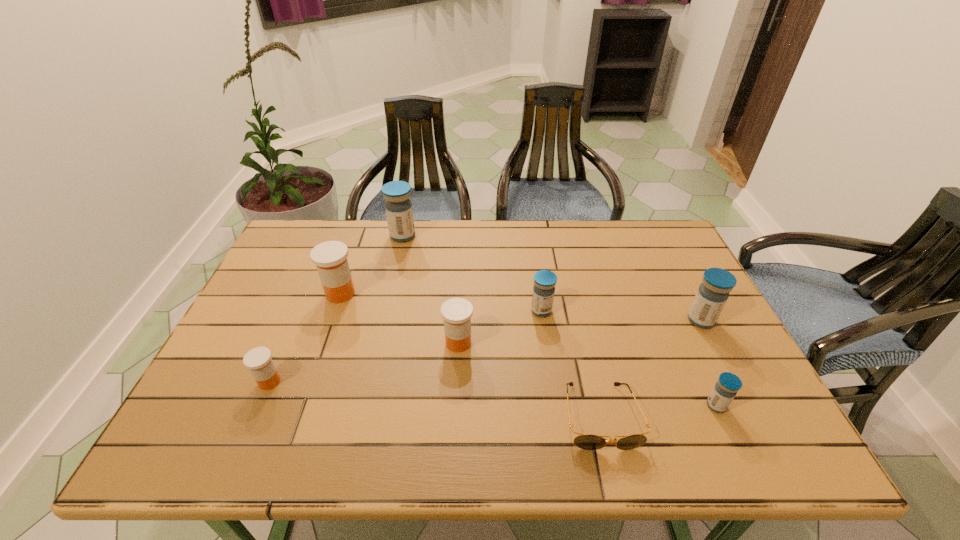
Identify the location of object that is the closest to the sunglasses. (x=728, y=384).

Identify which object is the sixth closest to the rightmost orange medicine. Please provide its 2D coordinates. Your answer should be formatted as a tuple, i.e. [(x, y)], where the tuple contains the x and y coordinates of a point satisfying the conditions above.

[(728, 384)]

Locate which medicine ranks in proximity to the nearest orange medicine. Please provide its 2D coordinates. Your answer should be formatted as a tuple, i.e. [(x, y)], where the tuple contains the x and y coordinates of a point satisfying the conditions above.

[(330, 258)]

At what (x,y) coordinates should I click in order to perform the action: click on medicine that stands as the fourth closest to the rightmost orange medicine. Please return your answer as a coordinate pair (x, y). The image size is (960, 540). Looking at the image, I should click on (398, 206).

This screenshot has width=960, height=540. I want to click on blue medicine that is the closest to the nearest medicine, so click(713, 293).

Select which blue medicine is the second closest to the second medicine from left to right. Please provide its 2D coordinates. Your answer should be formatted as a tuple, i.e. [(x, y)], where the tuple contains the x and y coordinates of a point satisfying the conditions above.

[(544, 281)]

Locate an element on the screen. The height and width of the screenshot is (540, 960). the closest orange medicine relative to the third biggest blue medicine is located at coordinates (457, 312).

Choose which orange medicine is the second nearest neighbor to the fourth medicine from left to right. Please provide its 2D coordinates. Your answer should be formatted as a tuple, i.e. [(x, y)], where the tuple contains the x and y coordinates of a point satisfying the conditions above.

[(258, 360)]

Image resolution: width=960 pixels, height=540 pixels. In order to click on free point that satisfies the following two spatial constraints: 1. on the back side of the second blue medicine from left to right; 2. on the label of the second orange medicine from right to left in this screenshot , I will do `click(539, 294)`.